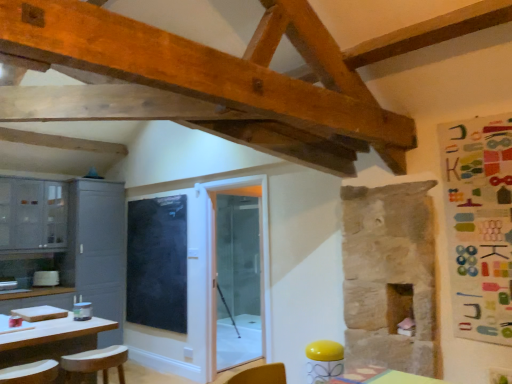
Question: Is colorful fabric bulletin board at right to the left of matte gray cabinets at left, which ranks as the first cabinetry in left-to-right order, from the viewer's perspective?

Choices:
 (A) no
 (B) yes

Answer: (A)

Question: Would you say colorful fabric bulletin board at right is outside matte gray cabinets at left, which ranks as the first cabinetry in left-to-right order?

Choices:
 (A) no
 (B) yes

Answer: (B)

Question: Is colorful fabric bulletin board at right closer to the viewer compared to matte gray cabinets at left, placed as the 2th cabinetry when sorted from right to left?

Choices:
 (A) no
 (B) yes

Answer: (B)

Question: From a real-world perspective, is colorful fabric bulletin board at right positioned under matte gray cabinets at left, which ranks as the first cabinetry in left-to-right order, based on gravity?

Choices:
 (A) no
 (B) yes

Answer: (B)

Question: Does colorful fabric bulletin board at right have a lesser height compared to matte gray cabinets at left, placed as the 2th cabinetry when sorted from right to left?

Choices:
 (A) no
 (B) yes

Answer: (A)

Question: Is colorful fabric bulletin board at right facing away from matte gray cabinets at left, which ranks as the first cabinetry in left-to-right order?

Choices:
 (A) no
 (B) yes

Answer: (A)

Question: Is transparent glass door at center not close to colorful fabric bulletin board at right?

Choices:
 (A) yes
 (B) no

Answer: (A)

Question: From the image's perspective, is transparent glass door at center below colorful fabric bulletin board at right?

Choices:
 (A) no
 (B) yes

Answer: (B)

Question: Is transparent glass door at center surrounding colorful fabric bulletin board at right?

Choices:
 (A) no
 (B) yes

Answer: (A)

Question: From the image's perspective, is transparent glass door at center above colorful fabric bulletin board at right?

Choices:
 (A) yes
 (B) no

Answer: (B)

Question: Does transparent glass door at center touch colorful fabric bulletin board at right?

Choices:
 (A) yes
 (B) no

Answer: (B)

Question: Is transparent glass door at center smaller than colorful fabric bulletin board at right?

Choices:
 (A) yes
 (B) no

Answer: (B)

Question: Can you confirm if matte gray cabinets at left, which ranks as the first cabinetry in left-to-right order, is shorter than transparent glass door at center?

Choices:
 (A) yes
 (B) no

Answer: (A)